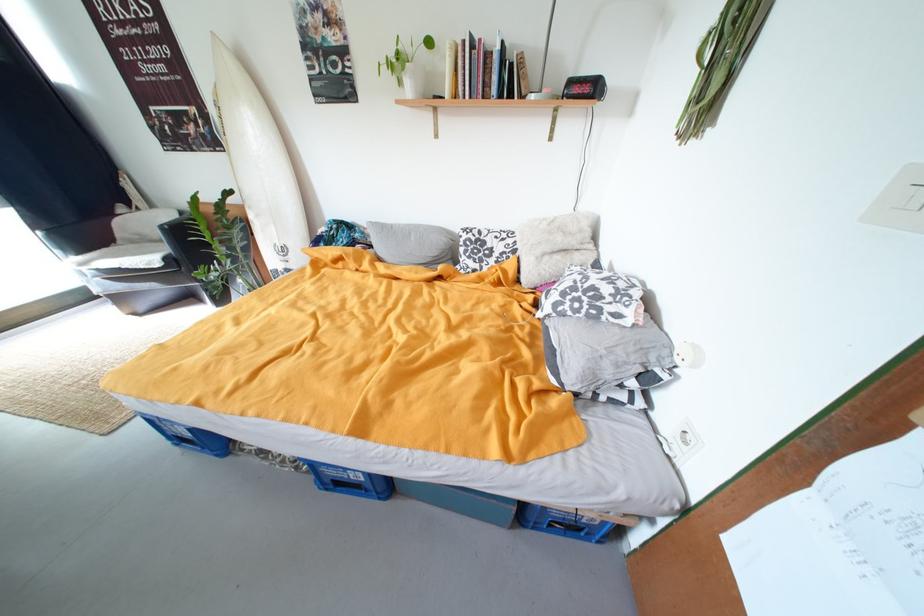
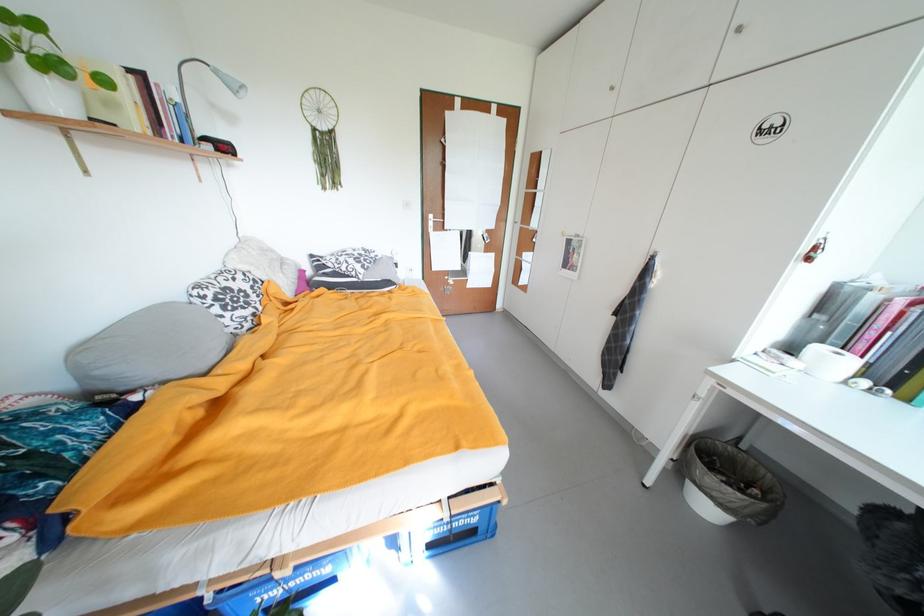
Find the pixel in the second image that matches (468,238) in the first image.

(211, 299)